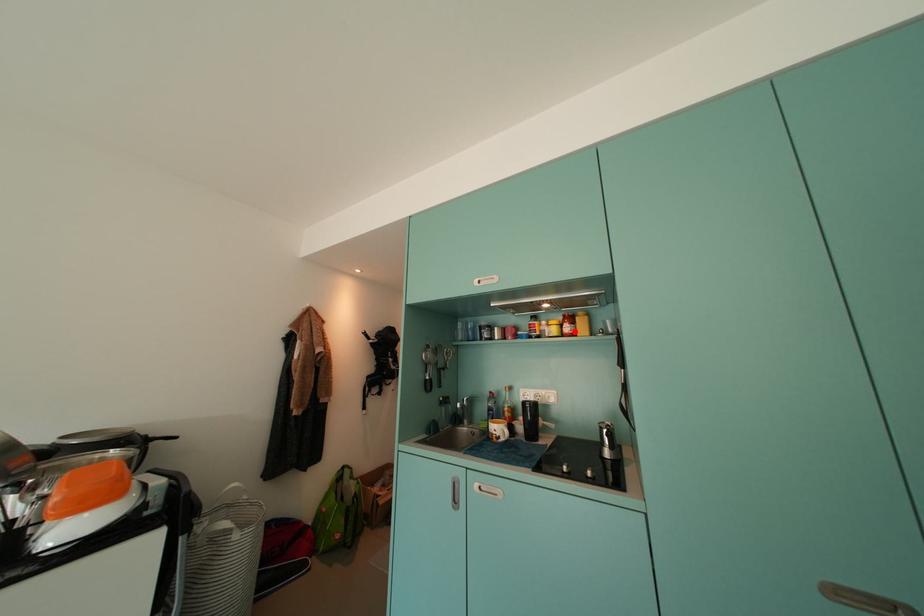
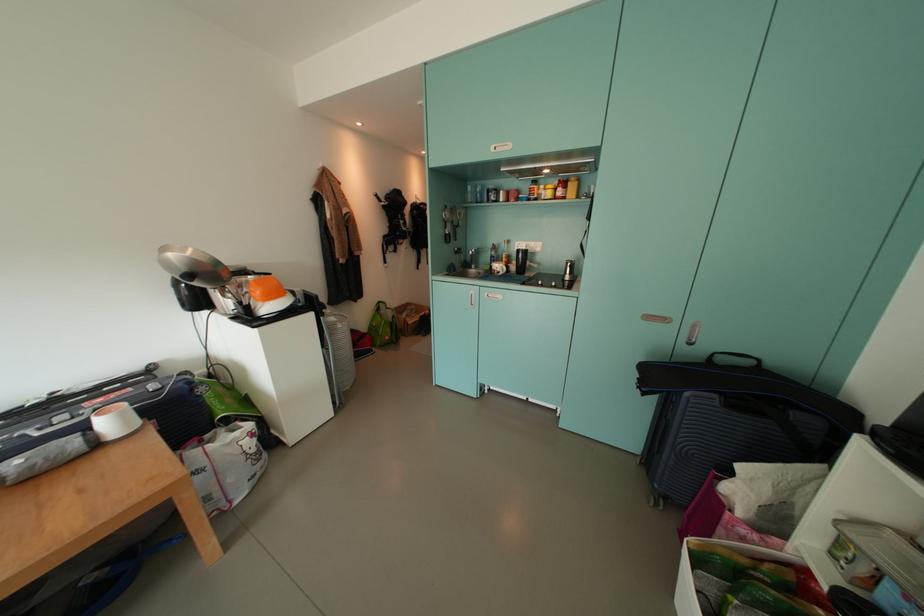
Where in the second image is the point corresponding to the highlighted location from the first image?

(566, 195)